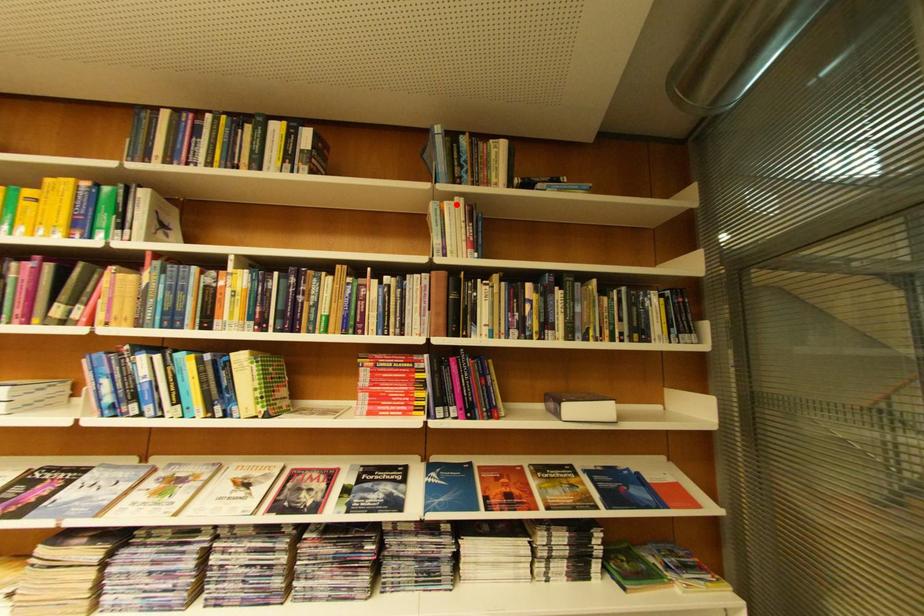
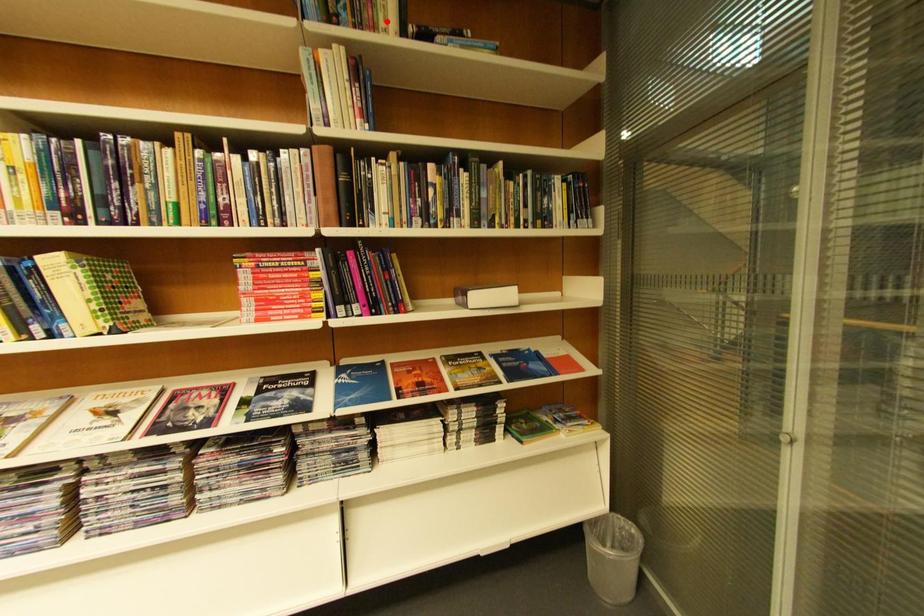
I am providing you with two images of the same scene from different viewpoints. A red point is marked on the first image and another point is marked on the second image. Is the red point in image1 aligned with the point shown in image2?

No